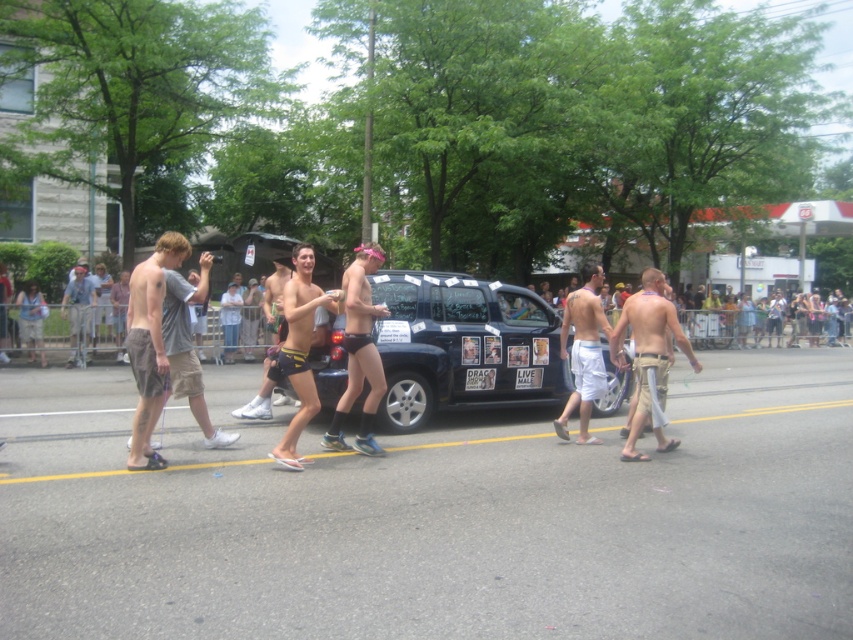
Which is more to the left, black matte car at center or white paper sign at center?

black matte car at center is more to the left.

Does point (419, 355) lie in front of point (531, 376)?

Yes, point (419, 355) is in front of point (531, 376).

At what (x,y) coordinates should I click in order to perform the action: click on black matte car at center. Please return your answer as a coordinate pair (x, y). This screenshot has height=640, width=853. Looking at the image, I should click on (460, 344).

Is white cotton shorts at center above light blue denim shorts at left?

Indeed, white cotton shorts at center is positioned over light blue denim shorts at left.

Can you confirm if white cotton shorts at center is wider than light blue denim shorts at left?

Indeed, white cotton shorts at center has a greater width compared to light blue denim shorts at left.

Between point (584, 388) and point (73, 365), which one is positioned behind?

Point (73, 365)

This screenshot has width=853, height=640. What are the coordinates of `white cotton shorts at center` in the screenshot? It's located at (583, 353).

Is light blue denim shorts at left bigger than white paper sign at center?

Yes, light blue denim shorts at left is bigger than white paper sign at center.

Which of these two, light blue denim shorts at left or white paper sign at center, stands shorter?

Standing shorter between the two is white paper sign at center.

Where is `light blue denim shorts at left`? light blue denim shorts at left is located at coordinates (78, 312).